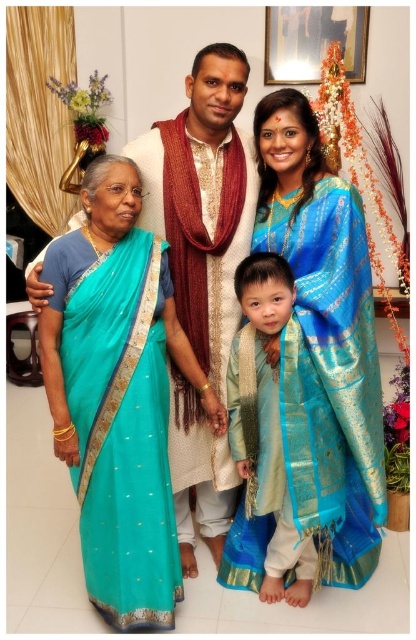
Who is more distant from viewer, (151, 580) or (304, 570)?

Point (304, 570)

Does teal silk saree at left have a lesser width compared to silk blue kurta at center?

In fact, teal silk saree at left might be wider than silk blue kurta at center.

What do you see at coordinates (121, 428) in the screenshot? I see `teal silk saree at left` at bounding box center [121, 428].

Image resolution: width=416 pixels, height=640 pixels. I want to click on teal silk saree at left, so click(121, 428).

Who is higher up, teal silk saree at left or blue silk saree at center?

blue silk saree at center is above.

Is teal silk saree at left smaller than blue silk saree at center?

Correct, teal silk saree at left occupies less space than blue silk saree at center.

Who is more distant from viewer, (126, 289) or (317, 483)?

The point (317, 483) is more distant.

Find the location of a particular element. teal silk saree at left is located at coordinates (121, 428).

Does blue silk saree at center appear on the left side of silk blue kurta at center?

In fact, blue silk saree at center is to the right of silk blue kurta at center.

What are the coordinates of `blue silk saree at center` in the screenshot? It's located at (331, 378).